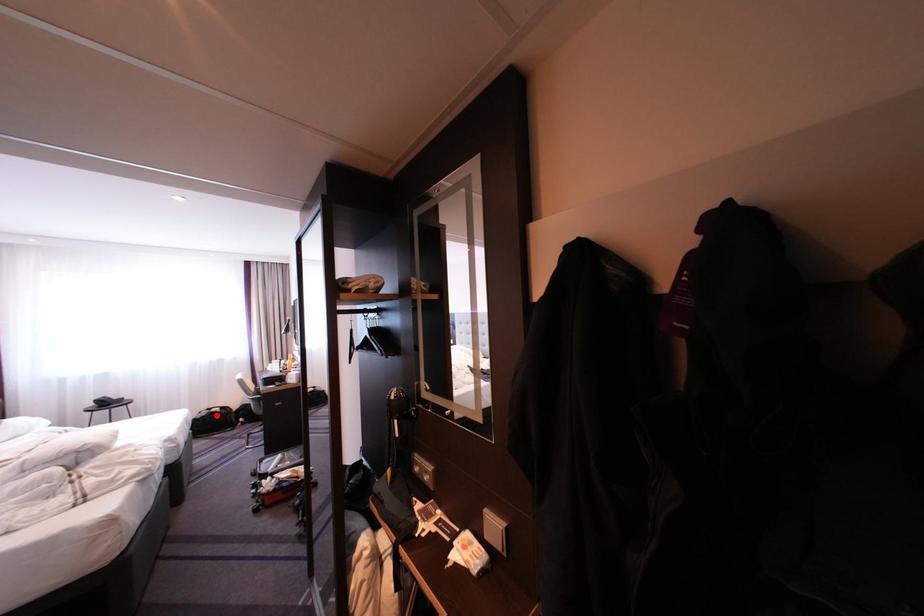
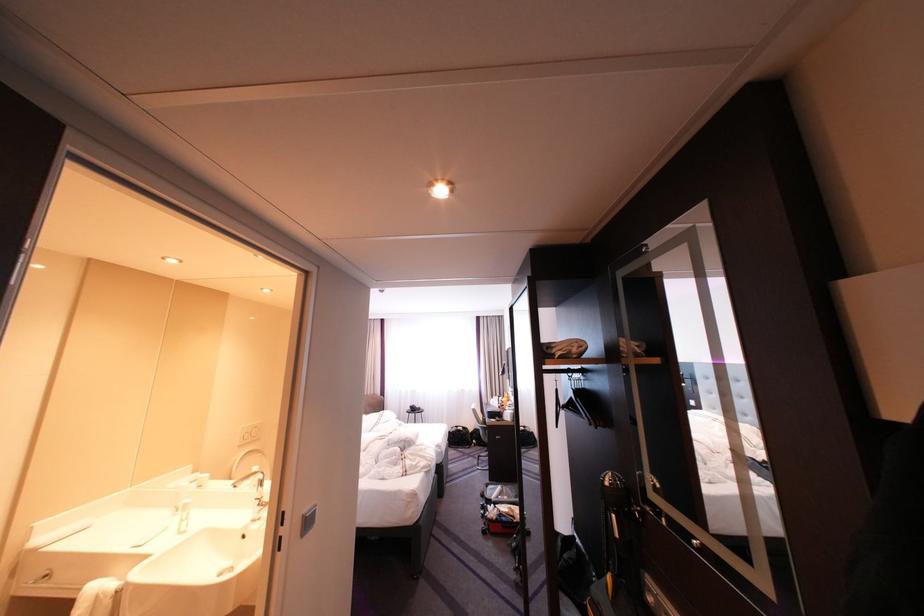
Question: I am providing you with two images of the same scene from different viewpoints. A red point is shown in image1. For the corresponding object point in image2, is it positioned nearer or farther from the camera?

Choices:
 (A) Nearer
 (B) Farther

Answer: (B)